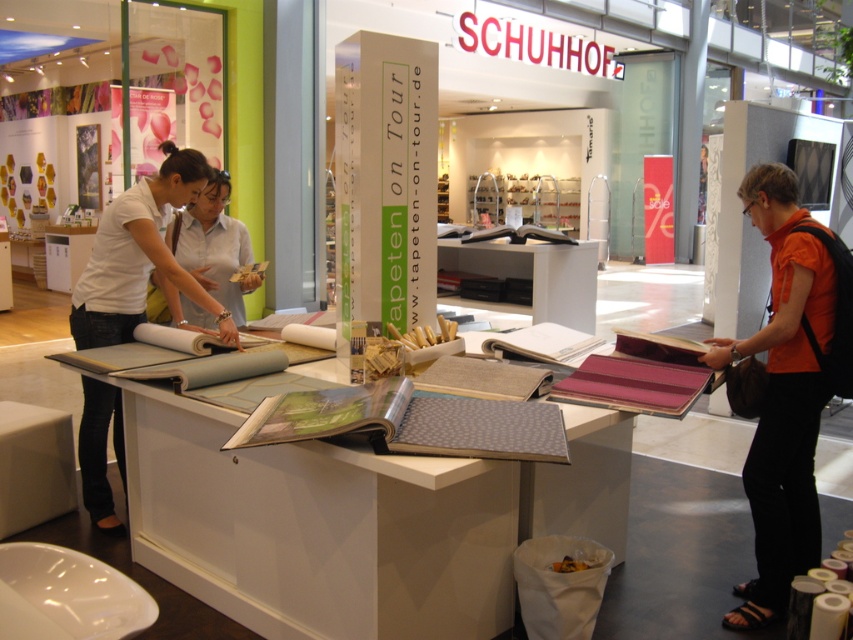
Does matte white blouse at left appear on the right side of white fabric at center?

Incorrect, matte white blouse at left is not on the right side of white fabric at center.

Does point (86, 342) come farther from viewer compared to point (224, 253)?

No, it is not.

Does point (192, 280) come closer to viewer compared to point (234, 268)?

Yes, point (192, 280) is in front of point (234, 268).

Identify the location of matte white blouse at left. (141, 257).

Which of these two, orange fabric shirt at right or matte white blouse at left, stands taller?

With more height is matte white blouse at left.

Which of these two, orange fabric shirt at right or matte white blouse at left, stands shorter?

With less height is orange fabric shirt at right.

Which is in front, point (799, 244) or point (125, 486)?

Point (799, 244) is more forward.

This screenshot has height=640, width=853. Find the location of `orange fabric shirt at right`. orange fabric shirt at right is located at coordinates (785, 388).

Is orange fabric shirt at right bigger than white fabric at center?

Yes.

Does orange fabric shirt at right have a greater width compared to white fabric at center?

Incorrect, orange fabric shirt at right's width does not surpass white fabric at center's.

Between point (816, 262) and point (229, 280), which one is positioned in front?

Positioned in front is point (816, 262).

The image size is (853, 640). I want to click on orange fabric shirt at right, so point(785,388).